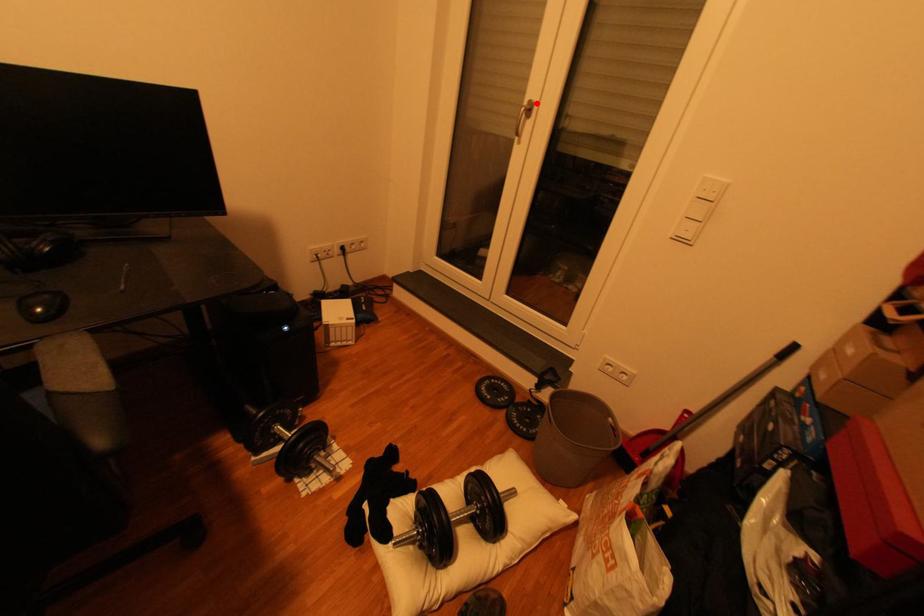
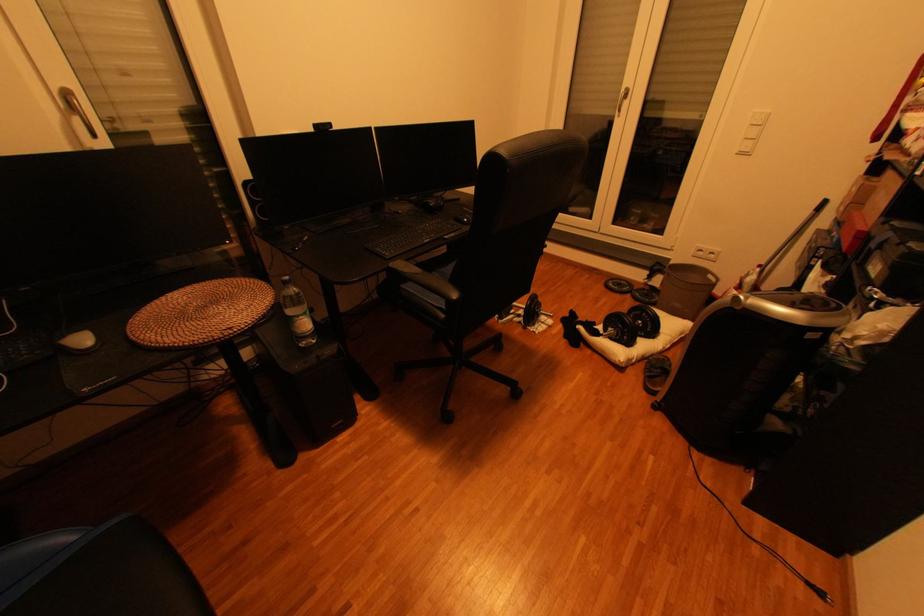
Locate, in the second image, the point that corresponds to the highlighted location in the first image.

(633, 91)